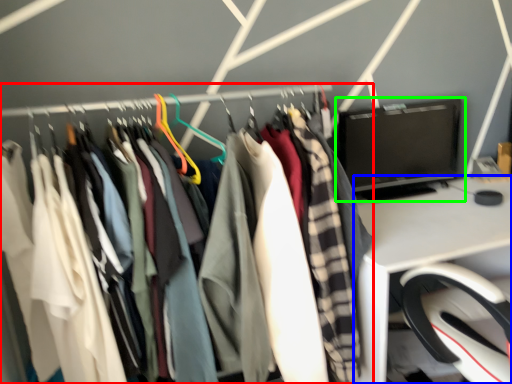
Question: Which object is positioned closest to closet (highlighted by a red box)? Select from desk (highlighted by a blue box) and computer monitor (highlighted by a green box).

Choices:
 (A) desk
 (B) computer monitor

Answer: (A)